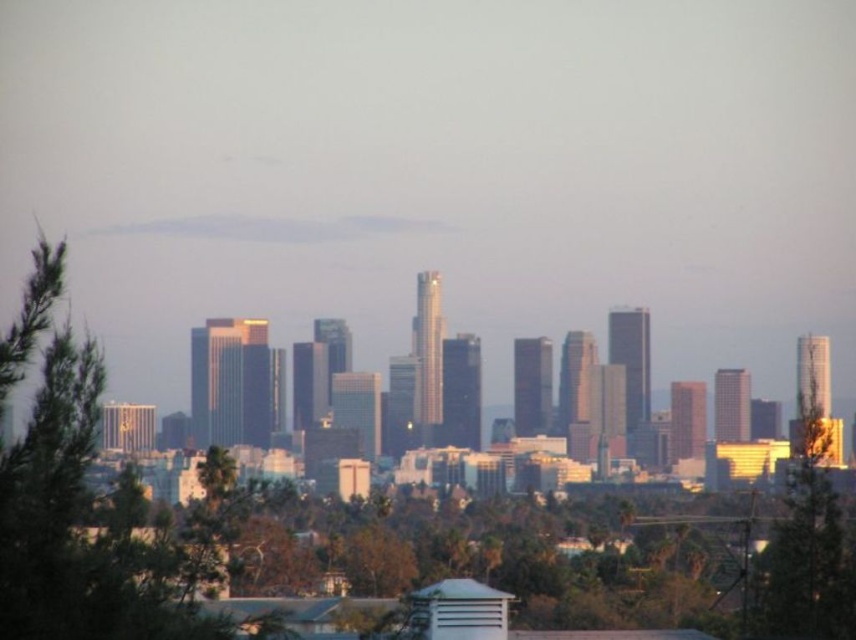
Question: Which object is closer to the camera taking this photo?

Choices:
 (A) green leafy tree at left
 (B) green leafy tree at right

Answer: (A)

Question: Does green leafy tree at left appear over green leafy tree at right?

Choices:
 (A) no
 (B) yes

Answer: (B)

Question: Which point is farther from the camera taking this photo?

Choices:
 (A) (70, 432)
 (B) (782, 541)

Answer: (B)

Question: Does green leafy tree at left lie in front of green leafy tree at right?

Choices:
 (A) yes
 (B) no

Answer: (A)

Question: Can you confirm if green leafy tree at left is positioned to the left of green leafy tree at right?

Choices:
 (A) yes
 (B) no

Answer: (A)